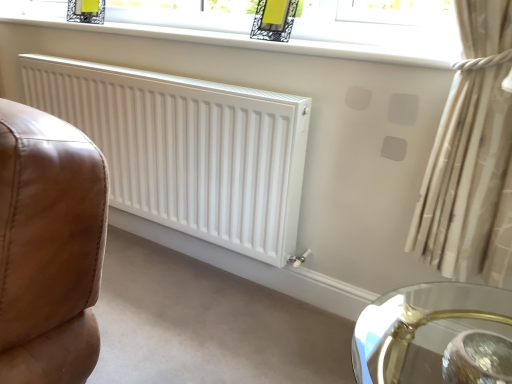
Question: Is white matte radiator at center placed right next to beige fabric curtain at right?

Choices:
 (A) no
 (B) yes

Answer: (A)

Question: From the image's perspective, would you say white matte radiator at center is positioned over beige fabric curtain at right?

Choices:
 (A) no
 (B) yes

Answer: (B)

Question: Can you confirm if white matte radiator at center is shorter than beige fabric curtain at right?

Choices:
 (A) yes
 (B) no

Answer: (B)

Question: Is the position of white matte radiator at center less distant than that of beige fabric curtain at right?

Choices:
 (A) yes
 (B) no

Answer: (B)

Question: Is white matte radiator at center further to the viewer compared to beige fabric curtain at right?

Choices:
 (A) no
 (B) yes

Answer: (B)

Question: Can you confirm if white matte radiator at center is bigger than beige fabric curtain at right?

Choices:
 (A) no
 (B) yes

Answer: (B)

Question: Considering the relative positions of beige fabric curtain at right and clear glass window at upper center in the image provided, is beige fabric curtain at right to the right of clear glass window at upper center from the viewer's perspective?

Choices:
 (A) no
 (B) yes

Answer: (B)

Question: From a real-world perspective, does beige fabric curtain at right stand above clear glass window at upper center?

Choices:
 (A) no
 (B) yes

Answer: (A)

Question: Is beige fabric curtain at right wider than clear glass window at upper center?

Choices:
 (A) yes
 (B) no

Answer: (B)

Question: Can you confirm if beige fabric curtain at right is smaller than clear glass window at upper center?

Choices:
 (A) no
 (B) yes

Answer: (A)

Question: Would you say beige fabric curtain at right contains clear glass window at upper center?

Choices:
 (A) yes
 (B) no

Answer: (B)

Question: Is beige fabric curtain at right aimed at clear glass window at upper center?

Choices:
 (A) no
 (B) yes

Answer: (A)

Question: From a real-world perspective, is clear glass window at upper center below beige fabric curtain at right?

Choices:
 (A) no
 (B) yes

Answer: (A)